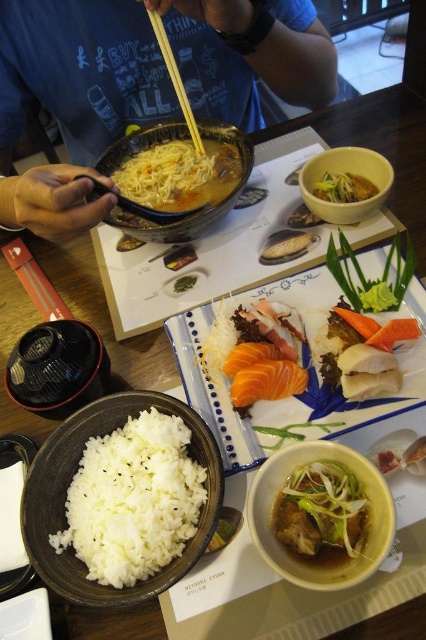
You are a diner sitting at the table and want to reach for the smooth yellow rice at center. Which dish should you move first if the matte ceramic bowl at center is blocking your access?

The matte ceramic bowl at center is closer to you than the smooth yellow rice at center, so you need to move the matte ceramic bowl at center first to access the smooth yellow rice at center.

You are a photographer trying to capture the best angle of the dining table. You notice two points of interest marked as point (371, 500) and point (334, 172). Which point should you focus on to ensure it appears larger in your photo?

Point (371, 500) is closer to the camera than point (334, 172), so focusing on point (371, 500) would make it appear larger in the photo.

You are a diner at the table and want to reach for the shiny brown noodles at center and the matte ceramic bowl at upper right. Which object is positioned higher on the table?

The shiny brown noodles at center is located above the matte ceramic bowl at upper right, so it is positioned higher on the table.